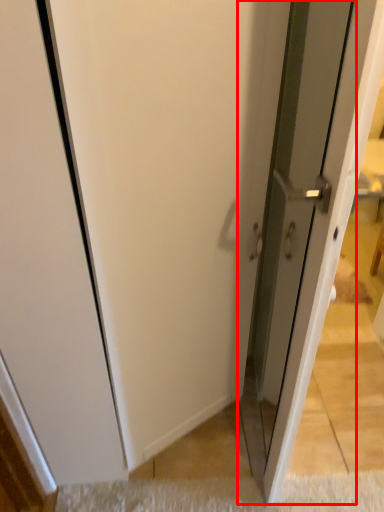
Question: Considering the relative positions of screen door (annotated by the red box) and doormat in the image provided, where is screen door (annotated by the red box) located with respect to the staircase?

Choices:
 (A) right
 (B) left

Answer: (A)